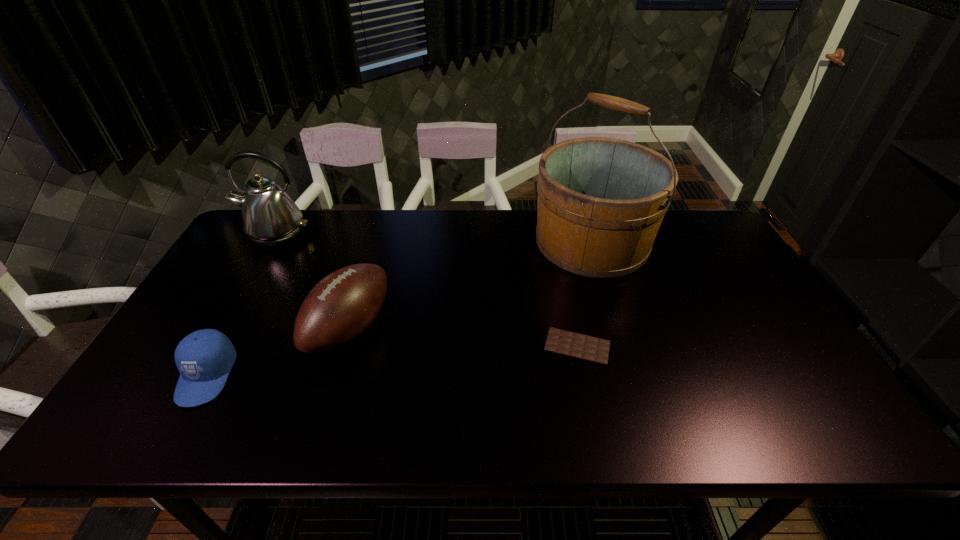
Locate an element on the screen. The width and height of the screenshot is (960, 540). vacant space at the left edge of the desktop is located at coordinates (239, 281).

Find the location of a particular element. free space at the right edge is located at coordinates (703, 261).

The height and width of the screenshot is (540, 960). In the image, there is a desktop. In order to click on free space at the far left corner in this screenshot , I will do `click(240, 252)`.

Image resolution: width=960 pixels, height=540 pixels. I want to click on blank space at the far right corner of the desktop, so click(x=668, y=225).

Find the location of a particular element. Image resolution: width=960 pixels, height=540 pixels. unoccupied position between the second tallest object and the third shortest object is located at coordinates (313, 281).

I want to click on empty location between the football (American) and the kettle, so click(x=313, y=281).

The height and width of the screenshot is (540, 960). What are the coordinates of `free area in between the shortest object and the bucket` in the screenshot? It's located at (585, 294).

Identify the location of free space between the tallest object and the cap. The width and height of the screenshot is (960, 540). (399, 309).

The height and width of the screenshot is (540, 960). In order to click on free space between the shortest object and the third object from right to left in this screenshot , I will do `click(464, 337)`.

Locate an element on the screen. The image size is (960, 540). vacant area that lies between the bucket and the third tallest object is located at coordinates (470, 285).